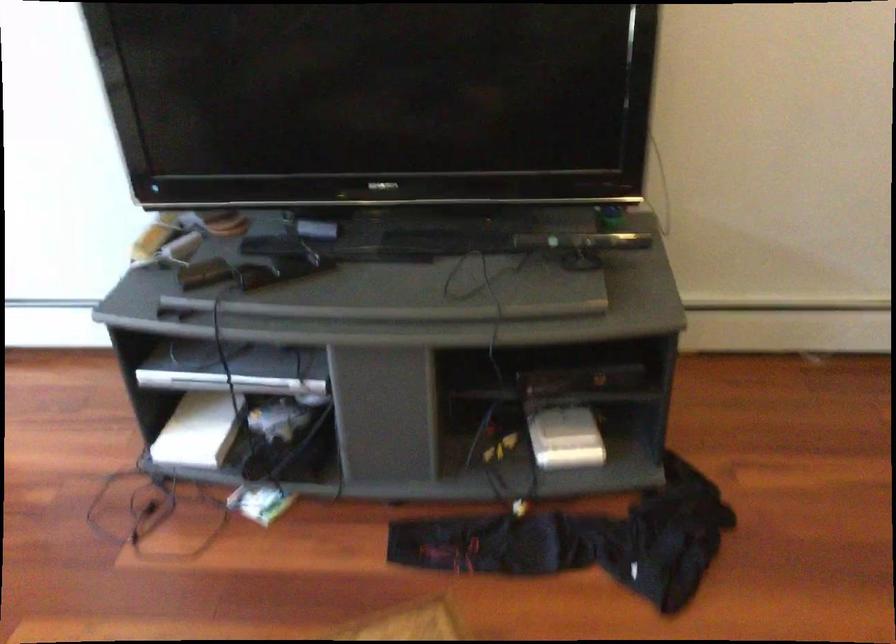
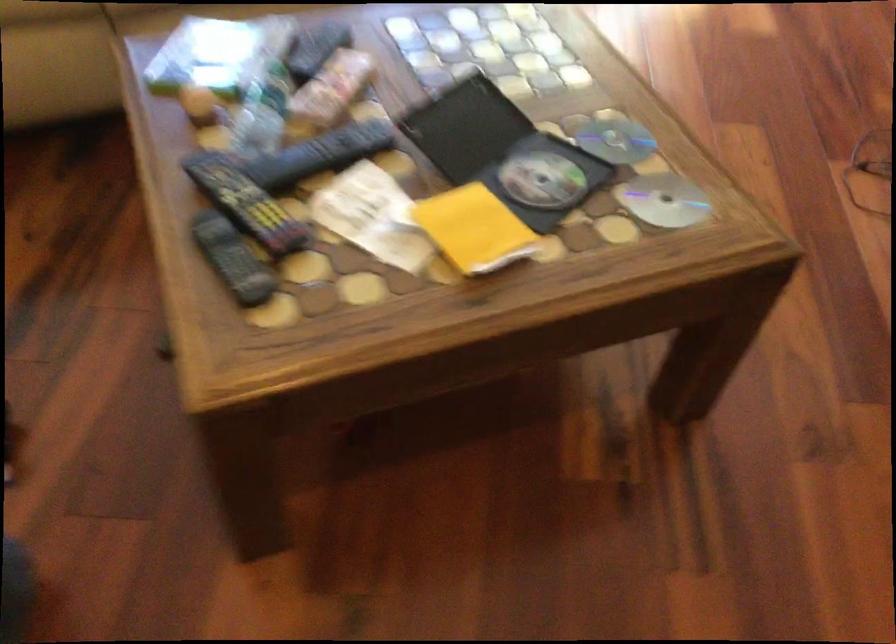
The images are taken continuously from a first-person perspective. In which direction is your viewpoint rotating?

The rotation direction of the camera is left-down.